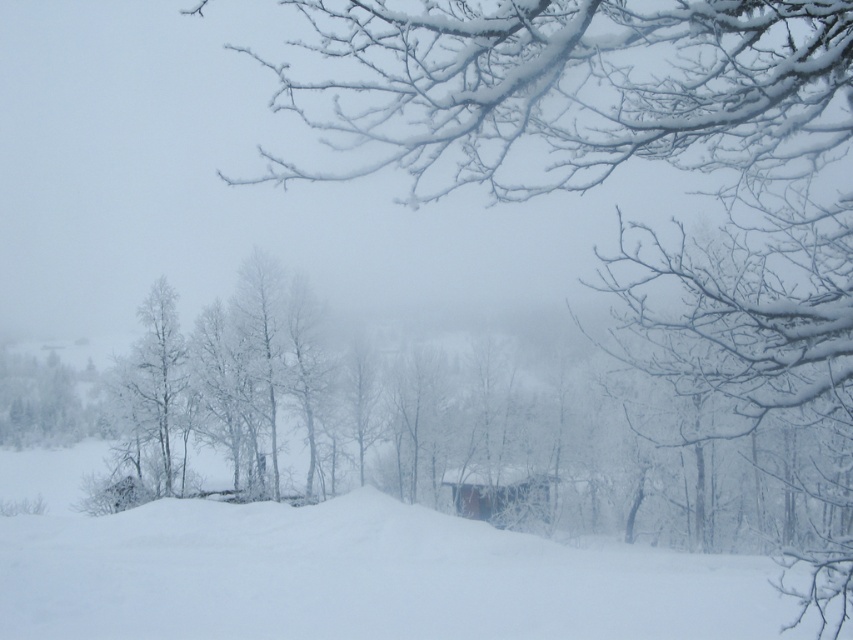
Question: Which point appears closest to the camera in this image?

Choices:
 (A) (45, 378)
 (B) (461, 496)

Answer: (B)

Question: Can you confirm if green matte tree at left is thinner than wooden cabin at center?

Choices:
 (A) yes
 (B) no

Answer: (A)

Question: Which point is farther to the camera?

Choices:
 (A) (7, 353)
 (B) (468, 476)

Answer: (A)

Question: Can you confirm if green matte tree at left is positioned below wooden cabin at center?

Choices:
 (A) no
 (B) yes

Answer: (A)

Question: Which point is farther from the camera taking this photo?

Choices:
 (A) (0, 404)
 (B) (515, 515)

Answer: (A)

Question: Is green matte tree at left to the left of wooden cabin at center from the viewer's perspective?

Choices:
 (A) yes
 (B) no

Answer: (A)